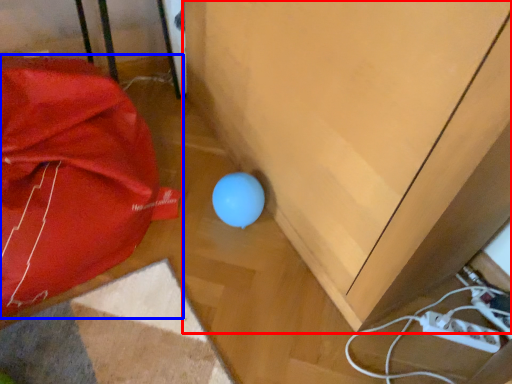
Question: Which object is further to the camera taking this photo, furniture (highlighted by a red box) or umbrella (highlighted by a blue box)?

Choices:
 (A) furniture
 (B) umbrella

Answer: (B)